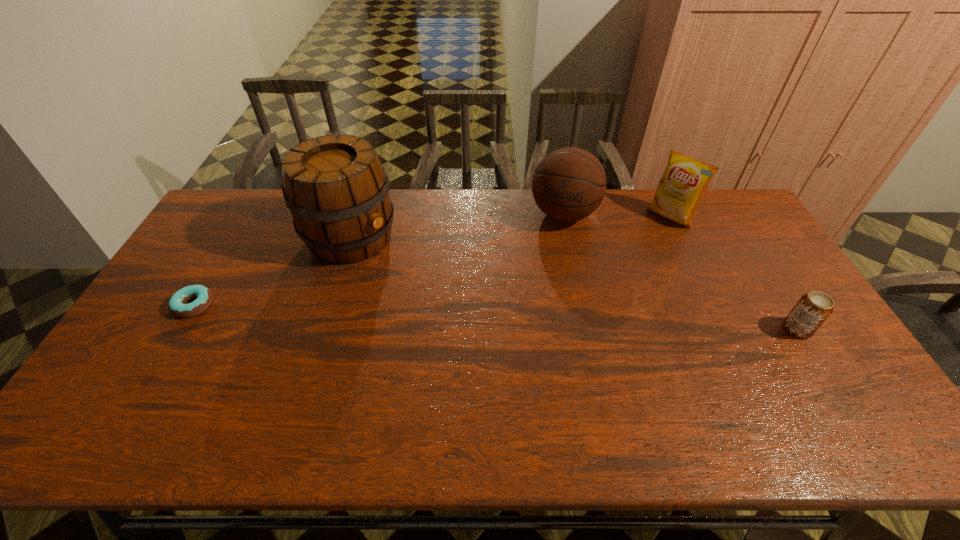
Locate an element on the screen. This screenshot has width=960, height=540. vacant area that lies between the fourth object from left to right and the beer can is located at coordinates (734, 273).

Locate an element on the screen. The width and height of the screenshot is (960, 540). free space that is in between the doughnut and the fourth object from left to right is located at coordinates (432, 261).

This screenshot has width=960, height=540. In order to click on unoccupied area between the basketball and the tallest object in this screenshot , I will do `click(457, 226)`.

Where is `free area in between the third object from left to right and the shortest object`? This screenshot has height=540, width=960. free area in between the third object from left to right and the shortest object is located at coordinates (379, 260).

This screenshot has width=960, height=540. Identify the location of free spot between the shortest object and the basketball. (379, 260).

The height and width of the screenshot is (540, 960). Identify the location of vacant area that lies between the basketball and the fourth object from right to left. (457, 226).

Locate an element on the screen. This screenshot has height=540, width=960. vacant space that is in between the crisp (potato chip) and the shortest object is located at coordinates (432, 261).

I want to click on vacant area between the crisp (potato chip) and the tallest object, so click(511, 227).

What are the coordinates of `the closest object to the tallest object` in the screenshot? It's located at (177, 306).

This screenshot has width=960, height=540. In order to click on object that is the second closest to the fourth object from left to right in this screenshot , I will do `click(812, 310)`.